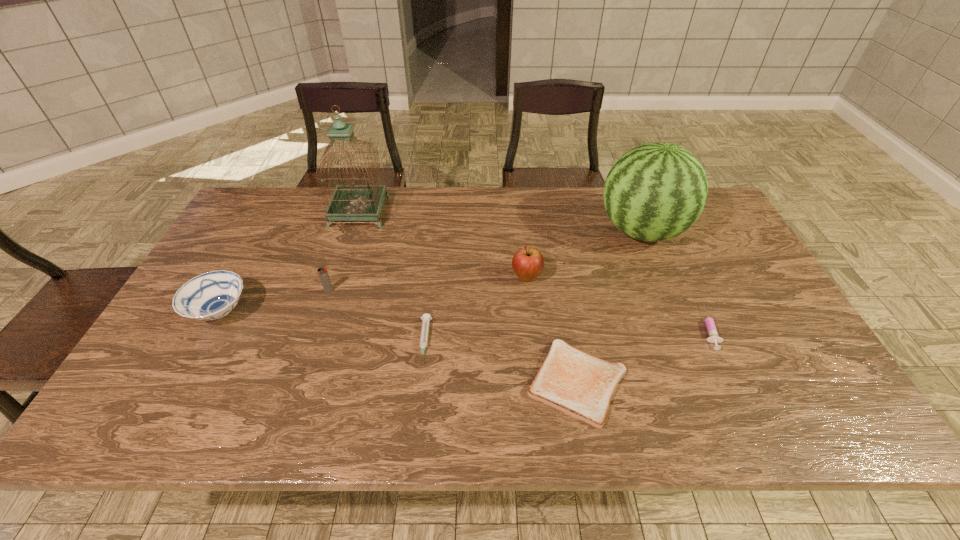
Image resolution: width=960 pixels, height=540 pixels. Identify the location of vacant space that satisfies the following two spatial constraints: 1. at the door of the toast; 2. on the left side of the birdcage. (304, 382).